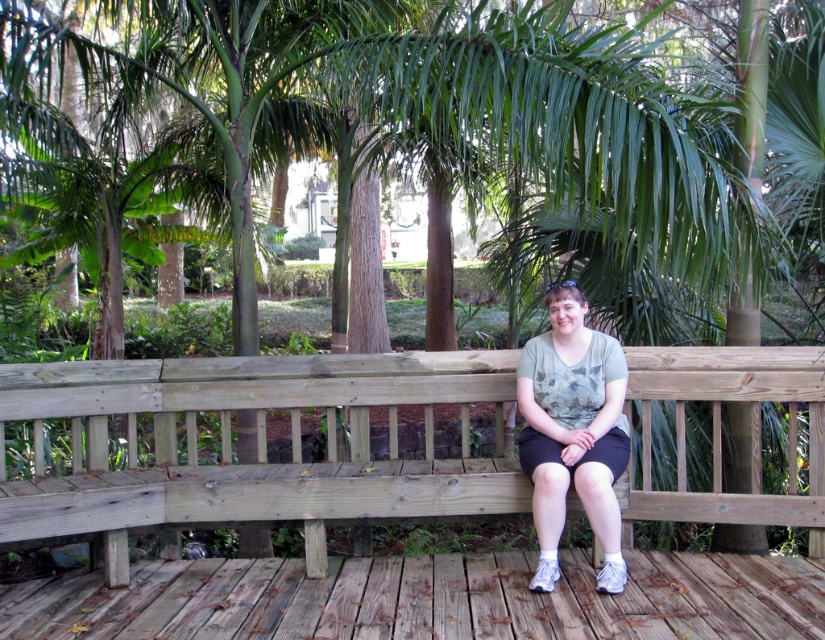
How far apart are wooden bench at center and camouflage t-shirt at center?

22.78 inches

Measure the distance between wooden bench at center and camouflage t-shirt at center.

They are 57.85 centimeters apart.

The image size is (825, 640). What do you see at coordinates (257, 444) in the screenshot?
I see `wooden bench at center` at bounding box center [257, 444].

Where is `wooden bench at center`? The image size is (825, 640). wooden bench at center is located at coordinates (257, 444).